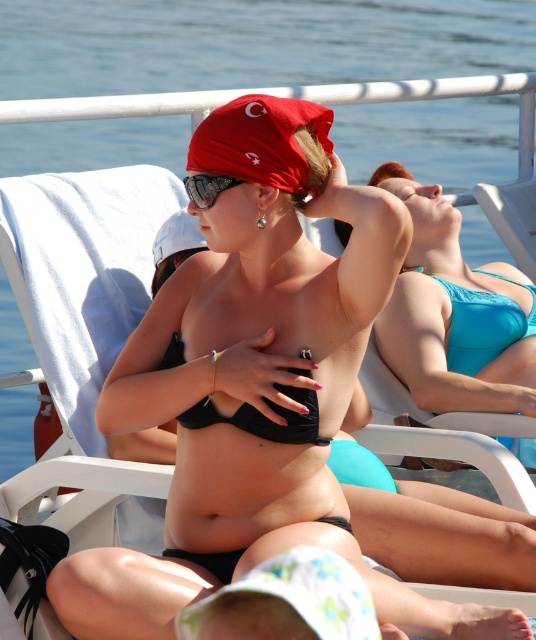
What is the color of the bikini located at the coordinates point [483,323]?

The point [483,323] corresponds to the teal matte bikini at upper right.